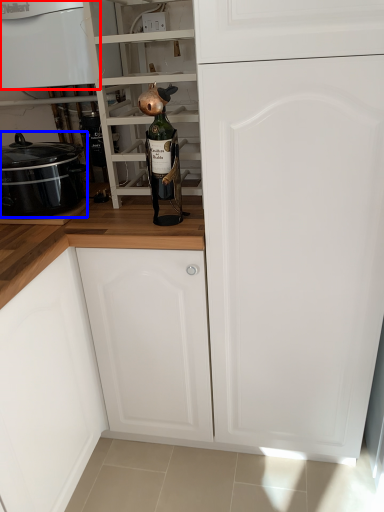
Question: Which object appears farthest to the camera in this image, home appliance (highlighted by a red box) or kitchen appliance (highlighted by a blue box)?

Choices:
 (A) home appliance
 (B) kitchen appliance

Answer: (B)